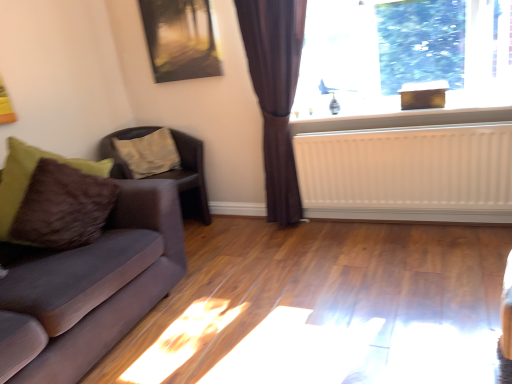
Question: Considering the positions of transparent glass window at upper right and metallic reflective painting at upper center in the image, is transparent glass window at upper right taller or shorter than metallic reflective painting at upper center?

Choices:
 (A) tall
 (B) short

Answer: (A)

Question: In terms of size, does transparent glass window at upper right appear bigger or smaller than metallic reflective painting at upper center?

Choices:
 (A) small
 (B) big

Answer: (B)

Question: Based on their relative distances, which object is farther from the white matte radiator at upper right?

Choices:
 (A) brown fabric curtain at center
 (B) brown leather chair at left
 (C) metallic reflective painting at upper center
 (D) brown textured pillow at left
 (E) transparent glass window at upper right

Answer: (D)

Question: Which of these objects is positioned closest to the brown textured pillow at left?

Choices:
 (A) white matte radiator at upper right
 (B) velvet grey couch at left
 (C) brown leather chair at left
 (D) brown fabric curtain at center
 (E) white painted wood at upper right

Answer: (C)